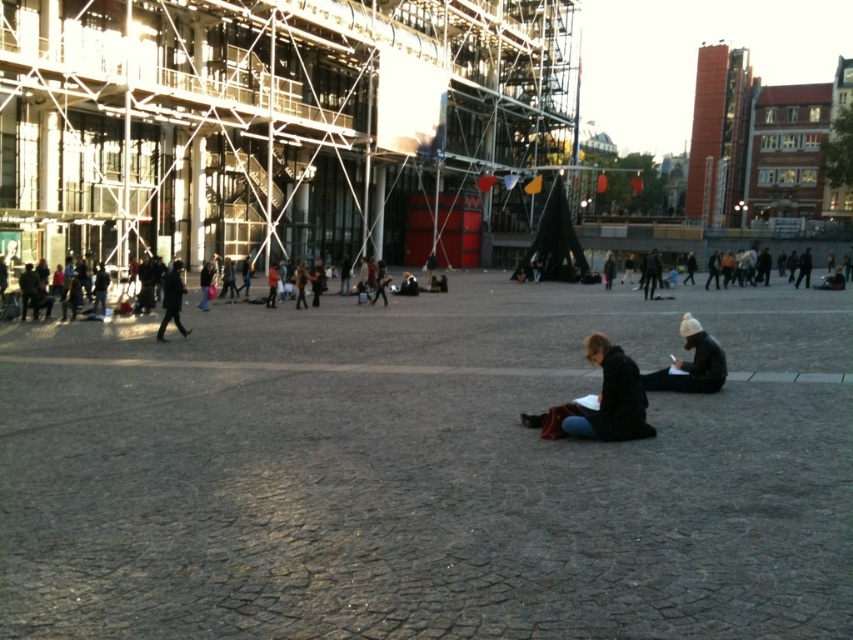
Question: Which of the following is the farthest from the observer?

Choices:
 (A) (173, 276)
 (B) (704, 340)
 (C) (634, 369)

Answer: (A)

Question: Is the position of jeans at center less distant than that of white knit hat at center?

Choices:
 (A) no
 (B) yes

Answer: (B)

Question: Is jeans at center positioned before dark gray coat at left?

Choices:
 (A) no
 (B) yes

Answer: (B)

Question: Observing the image, what is the correct spatial positioning of white knit hat at center in reference to dark gray coat at left?

Choices:
 (A) left
 (B) right

Answer: (B)

Question: Estimate the real-world distances between objects in this image. Which object is closer to the jeans at center?

Choices:
 (A) dark gray coat at left
 (B) white knit hat at center

Answer: (B)

Question: Considering the real-world distances, which object is closest to the white knit hat at center?

Choices:
 (A) jeans at center
 (B) dark gray coat at left

Answer: (A)